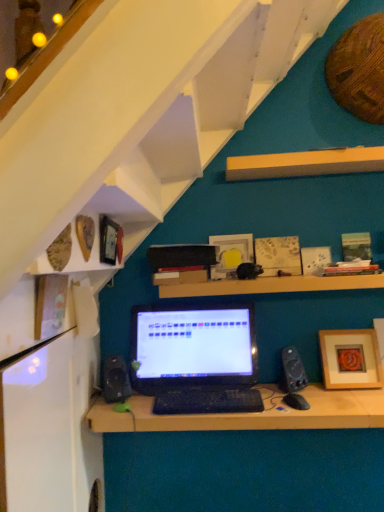
The image size is (384, 512). What are the coordinates of `wooden at center, arranged as the 3th shelf when viewed from the top` in the screenshot? It's located at (272, 285).

Image resolution: width=384 pixels, height=512 pixels. What do you see at coordinates (296, 401) in the screenshot?
I see `black matte computer mouse at lower right` at bounding box center [296, 401].

Consider the image. Measure the distance between point (152, 349) and camera.

6.33 feet.

You are a GUI agent. You are given a task and a screenshot of the screen. Output one action in this format:
    pyautogui.click(x=<x>, y=<y>)
    Task: Click on the wooden at center, the first shelf from the bottom
    This screenshot has height=512, width=384.
    Given the screenshot: What is the action you would take?
    pyautogui.click(x=272, y=285)

Considering the points (250, 234) and (198, 392), which point is in front, point (250, 234) or point (198, 392)?

The point (198, 392) is closer to the camera.

Would you say matte white picture frame at center, placed as the 3th picture frame when sorted from left to right, is to the left or to the right of black plastic keyboard at center in the picture?

Based on their positions, matte white picture frame at center, placed as the 3th picture frame when sorted from left to right, is located to the right of black plastic keyboard at center.

In order to click on picture frame that is the 3rd one when counting backward from the black plastic keyboard at center in this screenshot , I will do `click(235, 245)`.

From the image's perspective, between matte white picture frame at center, placed as the 3th picture frame when sorted from left to right, and black plastic keyboard at center, who is located below?

From the image's view, black plastic keyboard at center is below.

Would you consider wooden picture frame at lower right, positioned as the 1th picture frame in right-to-left order, to be distant from yellow wood shelf at upper center, arranged as the 1th shelf when viewed from the top?

No, wooden picture frame at lower right, positioned as the 1th picture frame in right-to-left order, is not far from yellow wood shelf at upper center, arranged as the 1th shelf when viewed from the top.

From the image's perspective, which one is positioned lower, wooden picture frame at lower right, the 3th picture frame from the back, or yellow wood shelf at upper center, positioned as the 3th shelf in bottom-to-top order?

wooden picture frame at lower right, the 3th picture frame from the back.

Considering the relative positions of wooden picture frame at lower right, the 3th picture frame from the back, and yellow wood shelf at upper center, arranged as the 1th shelf when viewed from the top, in the image provided, is wooden picture frame at lower right, the 3th picture frame from the back, behind yellow wood shelf at upper center, arranged as the 1th shelf when viewed from the top,?

Yes, wooden picture frame at lower right, the 3th picture frame from the back, is further from the viewer.

Identify the location of the 3rd shelf positioned above the wooden picture frame at lower right, the 3th picture frame from the back (from the image's perspective). (305, 163).

Which of these two, black plastic keyboard at center or black matte desk at center, stands taller?

black matte desk at center is taller.

From the image's perspective, is black plastic keyboard at center located beneath black matte desk at center?

No.

Considering the relative positions of black plastic keyboard at center and black matte desk at center in the image provided, is black plastic keyboard at center to the left or to the right of black matte desk at center?

Based on their positions, black plastic keyboard at center is located to the left of black matte desk at center.

Between black matte laptop at center and black matte speaker at right, which is the second loudspeaker in left-to-right order, which one is positioned in front?

black matte speaker at right, which is the second loudspeaker in left-to-right order, is more forward.

From the image's perspective, is black matte laptop at center positioned above or below black matte speaker at right, which is the second loudspeaker in left-to-right order?

black matte laptop at center is situated higher than black matte speaker at right, which is the second loudspeaker in left-to-right order, in the image.

From their relative heights in the image, would you say black matte laptop at center is taller or shorter than black matte speaker at right, which is the first loudspeaker from right to left?

In the image, black matte laptop at center appears to be taller than black matte speaker at right, which is the first loudspeaker from right to left.

Is there a large distance between black matte laptop at center and black matte speaker at right, which is the first loudspeaker from right to left?

No.

How far apart are wooden picture frame at lower right, positioned as the fifth picture frame in left-to-right order, and wooden picture frame at upper left, which is the 2th picture frame from left to right?

wooden picture frame at lower right, positioned as the fifth picture frame in left-to-right order, is 1.12 meters away from wooden picture frame at upper left, which is the 2th picture frame from left to right.

Locate an element on the screen. the 1st picture frame behind the wooden picture frame at upper left, marked as the 2th picture frame in a front-to-back arrangement, counting from the anchor's position is located at coordinates (350, 359).

From the image's perspective, who appears lower, wooden picture frame at lower right, the 3th picture frame from the back, or wooden picture frame at upper left, marked as the 2th picture frame in a front-to-back arrangement?

wooden picture frame at lower right, the 3th picture frame from the back, from the image's perspective.

Does wooden picture frame at lower right, positioned as the 1th picture frame in right-to-left order, touch wooden picture frame at upper left, which is the 2th picture frame from left to right?

wooden picture frame at lower right, positioned as the 1th picture frame in right-to-left order, is not next to wooden picture frame at upper left, which is the 2th picture frame from left to right, and they're not touching.

Considering the relative sizes of yellow wood shelf at upper center, positioned as the 3th shelf in bottom-to-top order, and black matte computer mouse at lower right in the image provided, is yellow wood shelf at upper center, positioned as the 3th shelf in bottom-to-top order, smaller than black matte computer mouse at lower right?

No, yellow wood shelf at upper center, positioned as the 3th shelf in bottom-to-top order, is not smaller than black matte computer mouse at lower right.

From the image's perspective, relative to black matte computer mouse at lower right, is yellow wood shelf at upper center, arranged as the 1th shelf when viewed from the top, above or below?

Based on their image positions, yellow wood shelf at upper center, arranged as the 1th shelf when viewed from the top, is located above black matte computer mouse at lower right.

Considering the sizes of objects yellow wood shelf at upper center, arranged as the 1th shelf when viewed from the top, and black matte computer mouse at lower right in the image provided, who is shorter, yellow wood shelf at upper center, arranged as the 1th shelf when viewed from the top, or black matte computer mouse at lower right?

black matte computer mouse at lower right is shorter.

Can you confirm if black plastic keyboard at center is positioned to the right of black matte computer mouse at lower right?

No, black plastic keyboard at center is not to the right of black matte computer mouse at lower right.

Is black plastic keyboard at center facing towards black matte computer mouse at lower right?

No, black plastic keyboard at center is not turned towards black matte computer mouse at lower right.

How much distance is there between black plastic keyboard at center and black matte computer mouse at lower right?

The distance of black plastic keyboard at center from black matte computer mouse at lower right is 12.17 inches.

Is black plastic keyboard at center inside or outside of black matte computer mouse at lower right?

black plastic keyboard at center lies outside black matte computer mouse at lower right.

The height and width of the screenshot is (512, 384). Identify the location of the 1st picture frame to the right of the black plastic keyboard at center, starting your count from the anchor. click(235, 245).

Starting from the wooden picture frame at lower right, positioned as the fifth picture frame in left-to-right order, which shelf is the 1st one to the left? Please provide its 2D coordinates.

[(305, 163)]

From the image, which object appears to be nearer to wooden at center, the first shelf from the bottom, black matte laptop at center or yellow wood shelf at upper center, positioned as the 3th shelf in bottom-to-top order?

black matte laptop at center.

Looking at the image, which one is located closer to black matte speaker at lower left, the second loudspeaker in the right-to-left sequence, yellow wood shelf at upper center, arranged as the 1th shelf when viewed from the top, or black matte laptop at center?

black matte laptop at center is closer to black matte speaker at lower left, the second loudspeaker in the right-to-left sequence.

Which object lies nearer to the anchor point yellow wood shelf at upper center, arranged as the 1th shelf when viewed from the top, black matte computer mouse at lower right or matte white picture frame at center, the third picture frame from the right?

matte white picture frame at center, the third picture frame from the right, is closer to yellow wood shelf at upper center, arranged as the 1th shelf when viewed from the top.

From the image, which object appears to be nearer to black matte speaker at lower left, the 1th loudspeaker in the left-to-right sequence, black plastic keyboard at center or black matte computer mouse at lower right?

black plastic keyboard at center is closer to black matte speaker at lower left, the 1th loudspeaker in the left-to-right sequence.

Based on their spatial positions, is black plastic keyboard at center or black matte computer mouse at lower right further from wooden picture frame at lower right, positioned as the fifth picture frame in left-to-right order?

black plastic keyboard at center.

Estimate the real-world distances between objects in this image. Which object is further from wooden shelves at upper left, which is the second shelf from top to bottom, wooden picture frame at left, arranged as the fifth picture frame when viewed from the right, or yellow wood shelf at upper center, arranged as the 1th shelf when viewed from the top?

Among the two, yellow wood shelf at upper center, arranged as the 1th shelf when viewed from the top, is located further to wooden shelves at upper left, which is the second shelf from top to bottom.

Based on their spatial positions, is black matte speaker at lower left, the 1th loudspeaker in the left-to-right sequence, or matte white picture frame at center, positioned as the fifth picture frame in front-to-back order, further from black matte speaker at right, which is the first loudspeaker from right to left?

The object further to black matte speaker at right, which is the first loudspeaker from right to left, is black matte speaker at lower left, the 1th loudspeaker in the left-to-right sequence.

Consider the image. Based on their spatial positions, is black matte laptop at center or wooden picture frame at upper left, which ranks as the fourth picture frame in right-to-left order, further from matte white picture frame at center, which is the 1th picture frame in back-to-front order?

wooden picture frame at upper left, which ranks as the fourth picture frame in right-to-left order.

Find the location of a particular element. laptop between wooden picture frame at left, which is the first picture frame in front-to-back order, and black matte speaker at right, which is the first loudspeaker from right to left, from left to right is located at coordinates pyautogui.click(x=196, y=358).

Image resolution: width=384 pixels, height=512 pixels. Find the location of `computer mouse located between black matte desk at center and wooden picture frame at lower right, positioned as the 1th picture frame in right-to-left order, in the left-right direction`. computer mouse located between black matte desk at center and wooden picture frame at lower right, positioned as the 1th picture frame in right-to-left order, in the left-right direction is located at coordinates (296, 401).

Locate an element on the screen. This screenshot has width=384, height=512. shelf between wooden picture frame at upper left, which is the 2th picture frame from left to right, and wooden at center, arranged as the 3th shelf when viewed from the top is located at coordinates (114, 220).

This screenshot has width=384, height=512. Identify the location of laptop between matte white picture frame at center, placed as the 3th picture frame when sorted from left to right, and black matte speaker at lower left, the 1th loudspeaker in the left-to-right sequence, from top to bottom. coord(196,358).